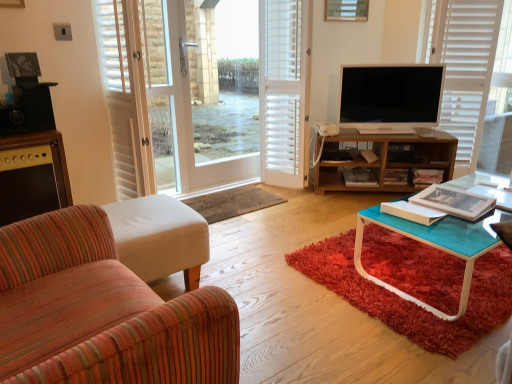
Question: Does rug at center have a lesser height compared to wooden picture frame at upper center?

Choices:
 (A) no
 (B) yes

Answer: (B)

Question: Is rug at center positioned beyond the bounds of wooden picture frame at upper center?

Choices:
 (A) yes
 (B) no

Answer: (A)

Question: Does rug at center have a greater width compared to wooden picture frame at upper center?

Choices:
 (A) yes
 (B) no

Answer: (A)

Question: Are rug at center and wooden picture frame at upper center making contact?

Choices:
 (A) no
 (B) yes

Answer: (A)

Question: Considering the relative sizes of rug at center and wooden picture frame at upper center in the image provided, is rug at center bigger than wooden picture frame at upper center?

Choices:
 (A) no
 (B) yes

Answer: (B)

Question: Is rug at center far away from wooden picture frame at upper center?

Choices:
 (A) yes
 (B) no

Answer: (A)

Question: From the image's perspective, is wooden shelf at center above white plastic corded phone at center?

Choices:
 (A) yes
 (B) no

Answer: (B)

Question: From a real-world perspective, is wooden shelf at center positioned under white plastic corded phone at center based on gravity?

Choices:
 (A) yes
 (B) no

Answer: (A)

Question: Can you confirm if wooden shelf at center is wider than white plastic corded phone at center?

Choices:
 (A) no
 (B) yes

Answer: (B)

Question: Is white plastic corded phone at center located within wooden shelf at center?

Choices:
 (A) no
 (B) yes

Answer: (A)

Question: Would you say wooden shelf at center is a long distance from white plastic corded phone at center?

Choices:
 (A) yes
 (B) no

Answer: (B)

Question: Does wooden shelf at center have a larger size compared to white plastic corded phone at center?

Choices:
 (A) no
 (B) yes

Answer: (B)

Question: Does white wood screen door at center appear on the left side of white wooden blind at upper right?

Choices:
 (A) yes
 (B) no

Answer: (A)